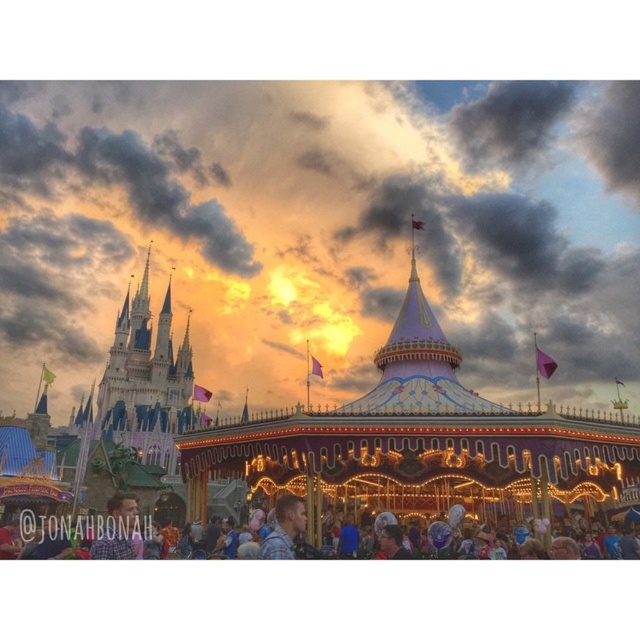
In order to click on plaid shirt at lower center in this screenshot , I will do `click(81, 536)`.

Is plaid shirt at lower center smaller than plaid shirt at center?

No, plaid shirt at lower center is not smaller than plaid shirt at center.

Locate an element on the screen. Image resolution: width=640 pixels, height=640 pixels. plaid shirt at lower center is located at coordinates (81, 536).

Can you confirm if shiny metallic carousel at center is bigger than blue plaid shirt at lower center?

Yes.

Identify the location of shiny metallic carousel at center. (314, 438).

Who is positioned more to the left, blue plaid shirt at lower center or plaid shirt at center?

blue plaid shirt at lower center is more to the left.

Where is `blue plaid shirt at lower center`? This screenshot has height=640, width=640. blue plaid shirt at lower center is located at coordinates (118, 531).

I want to click on blue plaid shirt at lower center, so click(x=118, y=531).